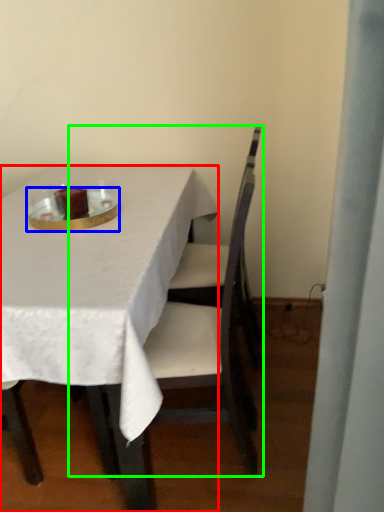
Question: Which is nearer to the table (highlighted by a red box)? tableware (highlighted by a blue box) or chair (highlighted by a green box).

Choices:
 (A) tableware
 (B) chair

Answer: (A)